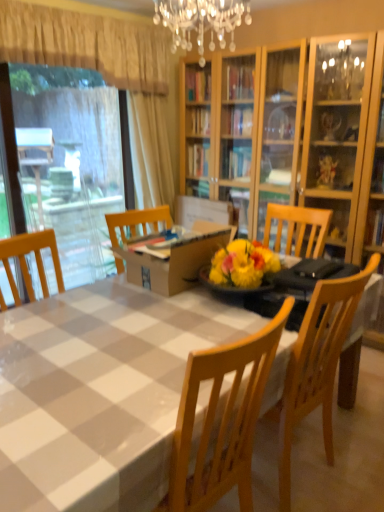
Question: Is white checkered tablecloth at center a part of brown cardboard box at center?

Choices:
 (A) no
 (B) yes

Answer: (A)

Question: Is brown cardboard box at center looking in the opposite direction of white checkered tablecloth at center?

Choices:
 (A) yes
 (B) no

Answer: (B)

Question: From the image's perspective, is brown cardboard box at center located above white checkered tablecloth at center?

Choices:
 (A) yes
 (B) no

Answer: (A)

Question: From the image's perspective, is brown cardboard box at center below white checkered tablecloth at center?

Choices:
 (A) no
 (B) yes

Answer: (A)

Question: From a real-world perspective, is brown cardboard box at center below white checkered tablecloth at center?

Choices:
 (A) yes
 (B) no

Answer: (B)

Question: Based on their positions, is beige fabric curtain at upper left located to the left or right of wooden chair at center?

Choices:
 (A) left
 (B) right

Answer: (A)

Question: In terms of height, does beige fabric curtain at upper left look taller or shorter compared to wooden chair at center?

Choices:
 (A) tall
 (B) short

Answer: (A)

Question: From the image's perspective, is beige fabric curtain at upper left located above or below wooden chair at center?

Choices:
 (A) above
 (B) below

Answer: (A)

Question: From a real-world perspective, is beige fabric curtain at upper left above or below wooden chair at center?

Choices:
 (A) below
 (B) above

Answer: (B)

Question: Based on their sizes in the image, would you say wooden chair at center is bigger or smaller than transparent plastic window screen at left?

Choices:
 (A) big
 (B) small

Answer: (B)

Question: From the image's perspective, is wooden chair at center located above or below transparent plastic window screen at left?

Choices:
 (A) below
 (B) above

Answer: (A)

Question: Relative to transparent plastic window screen at left, is wooden chair at center in front or behind?

Choices:
 (A) front
 (B) behind

Answer: (A)

Question: In the image, is wooden chair at center on the left side or the right side of transparent plastic window screen at left?

Choices:
 (A) left
 (B) right

Answer: (B)

Question: Is brown cardboard box at center bigger or smaller than beige fabric curtain at upper left?

Choices:
 (A) big
 (B) small

Answer: (B)

Question: Visually, is brown cardboard box at center positioned to the left or to the right of beige fabric curtain at upper left?

Choices:
 (A) left
 (B) right

Answer: (B)